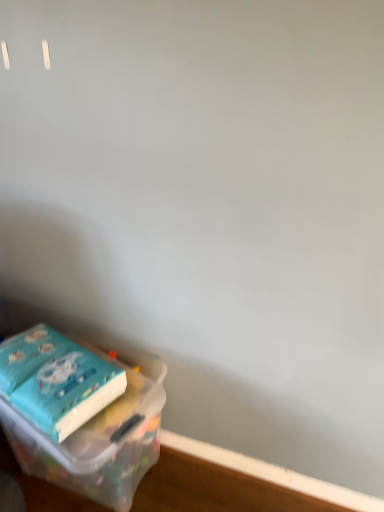
Image resolution: width=384 pixels, height=512 pixels. I want to click on free spot below translucent plastic container at lower left (from a real-world perspective), so click(x=100, y=493).